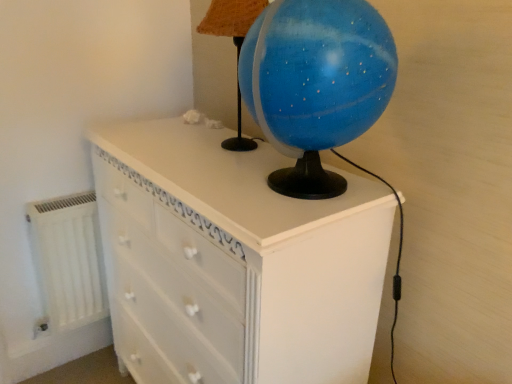
From the picture: In order to face white painted wood chest of drawers at center, should I rotate leftwards or rightwards?

It's best to rotate left around 5.298 degrees.

Where is `white matte radiator at lower left`? Image resolution: width=512 pixels, height=384 pixels. white matte radiator at lower left is located at coordinates (68, 259).

At what (x,y) coordinates should I click in order to perform the action: click on white painted wood chest of drawers at center. Please return your answer as a coordinate pair (x, y). Looking at the image, I should click on (234, 261).

Does point (238, 233) lie in front of point (91, 263)?

Yes.

From a real-world perspective, is white painted wood chest of drawers at center above or below white matte radiator at lower left?

white painted wood chest of drawers at center is above white matte radiator at lower left.

Considering the relative positions of white painted wood chest of drawers at center and white matte radiator at lower left in the image provided, is white painted wood chest of drawers at center to the right of white matte radiator at lower left from the viewer's perspective?

Indeed, white painted wood chest of drawers at center is positioned on the right side of white matte radiator at lower left.

Is white painted wood chest of drawers at center closer to the viewer compared to white matte radiator at lower left?

Result: That is True.

Find the location of a particular element. table lamp on the right of white matte radiator at lower left is located at coordinates (234, 44).

Does white matte radiator at lower left turn towards blue glossy globe at upper center?

No.

Based on the photo, is white matte radiator at lower left in contact with blue glossy globe at upper center?

No, white matte radiator at lower left is not next to blue glossy globe at upper center.

Can you confirm if white matte radiator at lower left is bigger than blue glossy globe at upper center?

Yes, white matte radiator at lower left is bigger than blue glossy globe at upper center.

Looking at this image, from a real-world perspective, which object rests below the other?

white matte radiator at lower left.

Where is `radiator below the white painted wood chest of drawers at center (from a real-world perspective)`? Image resolution: width=512 pixels, height=384 pixels. radiator below the white painted wood chest of drawers at center (from a real-world perspective) is located at coordinates coord(68,259).

Is white matte radiator at lower left taller or shorter than white painted wood chest of drawers at center?

white matte radiator at lower left is shorter than white painted wood chest of drawers at center.

What's the angular difference between white matte radiator at lower left and white painted wood chest of drawers at center's facing directions?

white matte radiator at lower left and white painted wood chest of drawers at center are facing 90.9 degrees away from each other.

Is blue glossy globe at upper center oriented away from white painted wood chest of drawers at center?

blue glossy globe at upper center is not turned away from white painted wood chest of drawers at center.

Which is behind, point (253, 9) or point (289, 271)?

The point (253, 9) is farther from the camera.

This screenshot has width=512, height=384. Find the location of `table lamp that appears on the right of white painted wood chest of drawers at center`. table lamp that appears on the right of white painted wood chest of drawers at center is located at coordinates (234, 44).

Does blue glossy globe at upper center touch white painted wood chest of drawers at center?

No, blue glossy globe at upper center is not beside white painted wood chest of drawers at center.

Considering the relative positions of white painted wood chest of drawers at center and blue glossy globe at upper center in the image provided, is white painted wood chest of drawers at center behind blue glossy globe at upper center?

That is False.

Who is taller, white painted wood chest of drawers at center or blue glossy globe at upper center?

Standing taller between the two is white painted wood chest of drawers at center.

Locate an element on the screen. The height and width of the screenshot is (384, 512). table lamp that appears above the white painted wood chest of drawers at center (from a real-world perspective) is located at coordinates (234, 44).

Considering the positions of objects white painted wood chest of drawers at center and blue glossy globe at upper center in the image provided, who is more to the left, white painted wood chest of drawers at center or blue glossy globe at upper center?

Positioned to the left is white painted wood chest of drawers at center.

Which of these two, blue glossy globe at upper center or white matte radiator at lower left, is smaller?

Smaller between the two is blue glossy globe at upper center.

In the image, is blue glossy globe at upper center positioned in front of or behind white matte radiator at lower left?

Clearly, blue glossy globe at upper center is in front of white matte radiator at lower left.

Is blue glossy globe at upper center surrounding white matte radiator at lower left?

No, white matte radiator at lower left is not surrounded by blue glossy globe at upper center.

The image size is (512, 384). What are the coordinates of `radiator lying above the white painted wood chest of drawers at center (from the image's perspective)` in the screenshot? It's located at (68, 259).

Where is `radiator that appears below the blue glossy globe at upper center (from a real-world perspective)`? This screenshot has width=512, height=384. radiator that appears below the blue glossy globe at upper center (from a real-world perspective) is located at coordinates (68, 259).

Estimate the real-world distances between objects in this image. Which object is further from white painted wood chest of drawers at center, white matte radiator at lower left or blue glossy globe at upper center?

Among the two, white matte radiator at lower left is located further to white painted wood chest of drawers at center.

Looking at the image, which one is located further to white matte radiator at lower left, blue glossy globe at upper center or white painted wood chest of drawers at center?

blue glossy globe at upper center is positioned further to the anchor white matte radiator at lower left.

Which object lies further to the anchor point blue glossy globe at upper center, white matte radiator at lower left or white painted wood chest of drawers at center?

Based on the image, white matte radiator at lower left appears to be further to blue glossy globe at upper center.

Based on their spatial positions, is blue glossy globe at upper center or white matte radiator at lower left further from white painted wood chest of drawers at center?

white matte radiator at lower left lies further to white painted wood chest of drawers at center than the other object.

Which object lies nearer to the anchor point blue glossy globe at upper center, white painted wood chest of drawers at center or white matte radiator at lower left?

white painted wood chest of drawers at center.

Considering their positions, is white painted wood chest of drawers at center positioned closer to white matte radiator at lower left than blue glossy globe at upper center?

Among the two, white painted wood chest of drawers at center is located nearer to white matte radiator at lower left.

Locate an element on the screen. This screenshot has width=512, height=384. table lamp between white painted wood chest of drawers at center and white matte radiator at lower left along the z-axis is located at coordinates (234, 44).